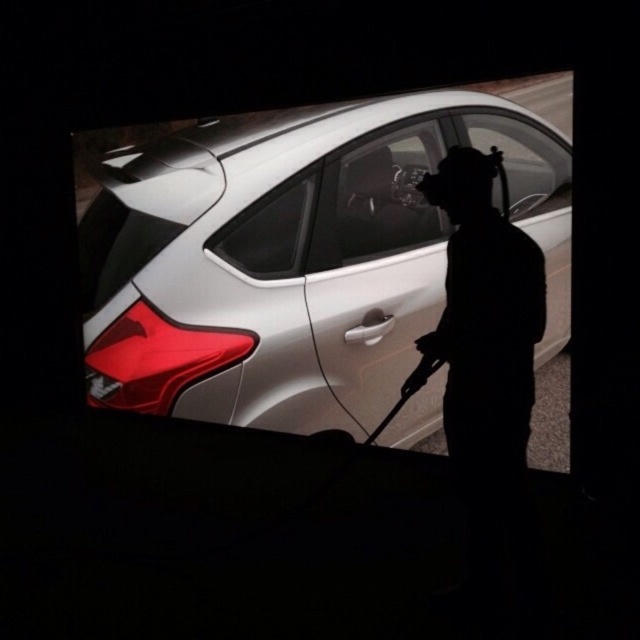
Is satin silver car at center thinner than silhouette figure at center?

Incorrect, satin silver car at center's width is not less than silhouette figure at center's.

Who is taller, satin silver car at center or silhouette figure at center?

satin silver car at center is taller.

Where is `satin silver car at center`? This screenshot has width=640, height=640. satin silver car at center is located at coordinates (296, 257).

Is clear glass window at center shorter than silhouette figure at center?

Correct, clear glass window at center is not as tall as silhouette figure at center.

Does clear glass window at center come in front of silhouette figure at center?

No, it is not.

Which is in front, point (566, 180) or point (486, 456)?

Point (486, 456) is more forward.

Where is `clear glass window at center`? This screenshot has height=640, width=640. clear glass window at center is located at coordinates (387, 193).

Is point (552, 131) more distant than point (342, 170)?

No, it is in front of (342, 170).

The image size is (640, 640). What do you see at coordinates (296, 257) in the screenshot? I see `satin silver car at center` at bounding box center [296, 257].

Where is `satin silver car at center`? The width and height of the screenshot is (640, 640). satin silver car at center is located at coordinates (296, 257).